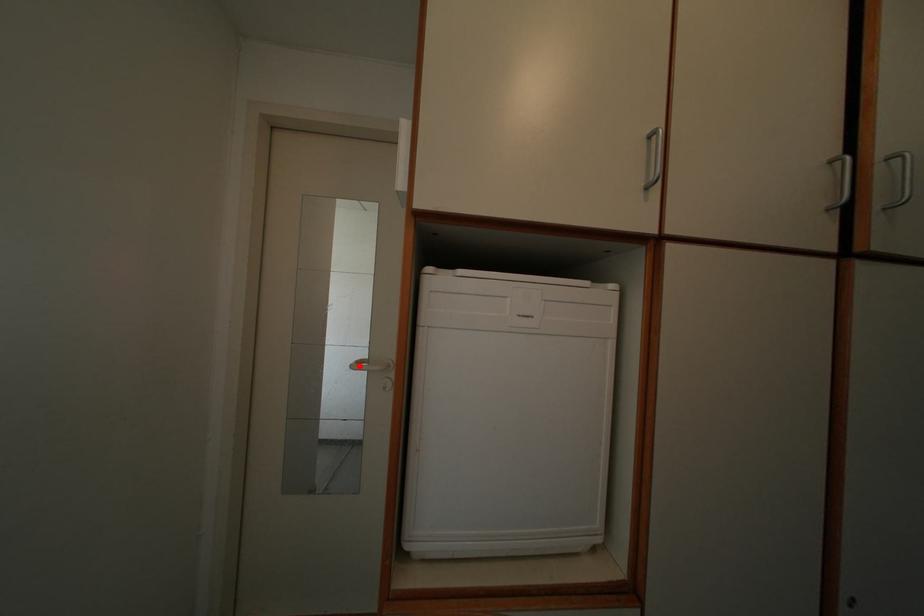
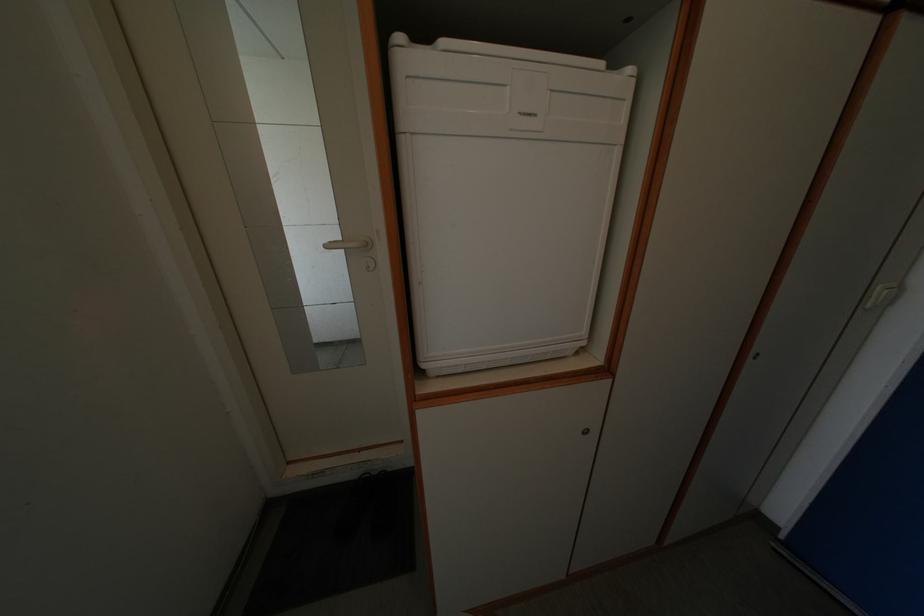
Where in the second image is the point corresponding to the highlighted location from the first image?

(332, 246)